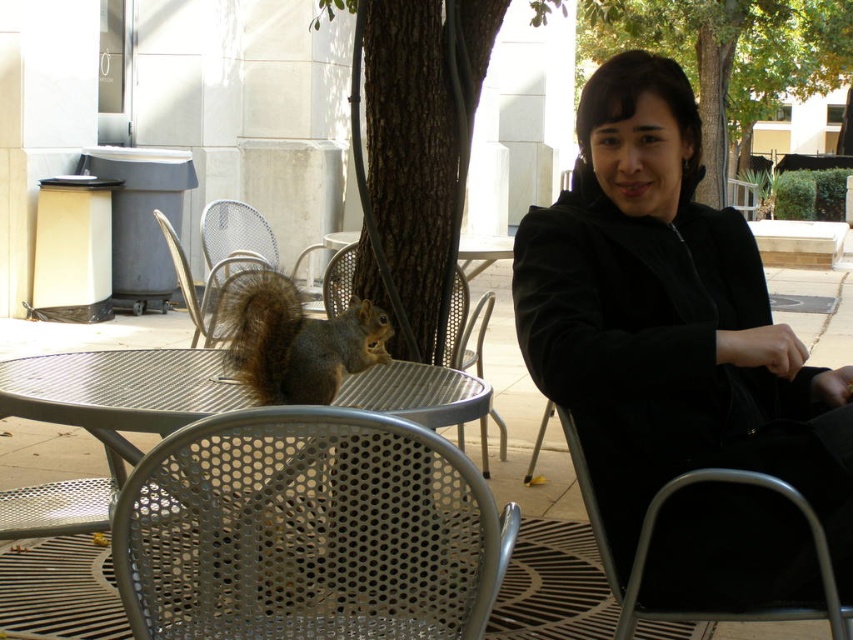
Question: Which object is closer to the camera taking this photo?

Choices:
 (A) brown fur squirrel at center
 (B) metallic mesh chair at lower center

Answer: (B)

Question: Is the position of metallic silver table at center less distant than that of metallic silver chair at center?

Choices:
 (A) no
 (B) yes

Answer: (B)

Question: Among these objects, which one is nearest to the camera?

Choices:
 (A) brown fur squirrel at center
 (B) metallic silver chair at center
 (C) metallic silver table at center

Answer: (A)

Question: Which point appears closest to the camera in this image?

Choices:
 (A) (698, 86)
 (B) (281, 576)
 (C) (317, 371)
 (D) (331, 278)

Answer: (B)

Question: Is green leafy tree at center above metallic silver chair at center?

Choices:
 (A) yes
 (B) no

Answer: (A)

Question: Can you confirm if metallic mesh chair at lower center is wider than brown rough bark tree at center?

Choices:
 (A) yes
 (B) no

Answer: (A)